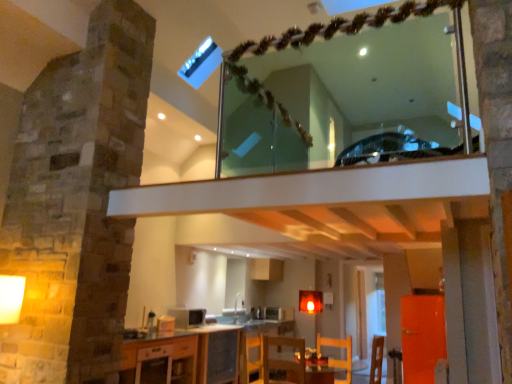
Question: Is wooden chair at lower center, which ranks as the second armchair in right-to-left order, directly adjacent to clear glass mirror at upper center?

Choices:
 (A) yes
 (B) no

Answer: (B)

Question: Is wooden chair at lower center, which appears as the 1th armchair when viewed from the left, turned away from clear glass mirror at upper center?

Choices:
 (A) yes
 (B) no

Answer: (B)

Question: Is the position of wooden chair at lower center, which appears as the 1th armchair when viewed from the left, less distant than that of clear glass mirror at upper center?

Choices:
 (A) yes
 (B) no

Answer: (B)

Question: From a real-world perspective, is wooden chair at lower center, which ranks as the second armchair in right-to-left order, located beneath clear glass mirror at upper center?

Choices:
 (A) yes
 (B) no

Answer: (A)

Question: From a real-world perspective, is wooden chair at lower center, which appears as the 1th armchair when viewed from the left, located higher than clear glass mirror at upper center?

Choices:
 (A) yes
 (B) no

Answer: (B)

Question: Is metallic silver microwave at center, which ranks as the 1th appliance in bottom-to-top order, spatially inside white glossy sink at center, or outside of it?

Choices:
 (A) outside
 (B) inside

Answer: (A)

Question: Visually, is metallic silver microwave at center, which ranks as the 1th appliance in bottom-to-top order, positioned to the left or to the right of white glossy sink at center?

Choices:
 (A) left
 (B) right

Answer: (B)

Question: From their relative heights in the image, would you say metallic silver microwave at center, which ranks as the 1th appliance in bottom-to-top order, is taller or shorter than white glossy sink at center?

Choices:
 (A) short
 (B) tall

Answer: (A)

Question: Relative to white glossy sink at center, is metallic silver microwave at center, the first appliance positioned from the back, in front or behind?

Choices:
 (A) front
 (B) behind

Answer: (B)

Question: In the image, is wooden chair at lower center, which appears as the 1th armchair when viewed from the left, positioned in front of or behind wooden chair at lower center, which is counted as the 2th armchair, starting from the left?

Choices:
 (A) front
 (B) behind

Answer: (A)

Question: Based on their positions, is wooden chair at lower center, which appears as the 1th armchair when viewed from the left, located to the left or right of wooden chair at lower center, which appears as the 1th armchair when viewed from the right?

Choices:
 (A) left
 (B) right

Answer: (A)

Question: Is wooden chair at lower center, which appears as the 1th armchair when viewed from the left, inside or outside of wooden chair at lower center, which is counted as the 2th armchair, starting from the left?

Choices:
 (A) inside
 (B) outside

Answer: (B)

Question: Considering the positions of wooden chair at lower center, which appears as the 1th armchair when viewed from the left, and wooden chair at lower center, which appears as the 1th armchair when viewed from the right, in the image, is wooden chair at lower center, which appears as the 1th armchair when viewed from the left, wider or thinner than wooden chair at lower center, which appears as the 1th armchair when viewed from the right,?

Choices:
 (A) thin
 (B) wide

Answer: (B)

Question: From their relative heights in the image, would you say wooden chair at lower center, which appears as the 1th armchair when viewed from the right, is taller or shorter than metallic silver microwave at center, which ranks as the 1th appliance in right-to-left order?

Choices:
 (A) tall
 (B) short

Answer: (A)

Question: In terms of width, does wooden chair at lower center, which appears as the 1th armchair when viewed from the right, look wider or thinner when compared to metallic silver microwave at center, which ranks as the 1th appliance in bottom-to-top order?

Choices:
 (A) thin
 (B) wide

Answer: (B)